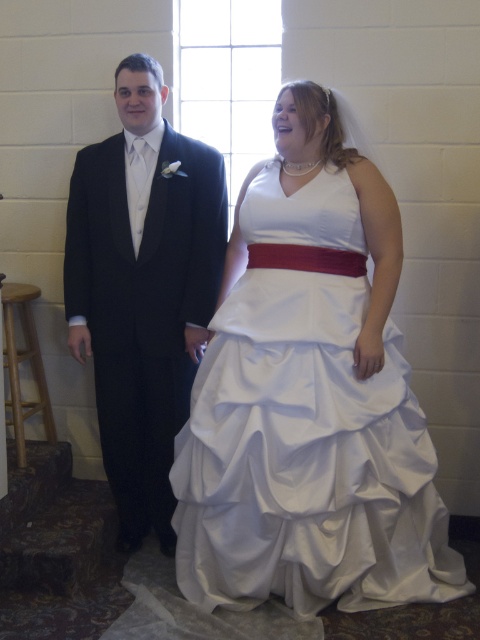
You are a photographer at a wedding. You need to position the couple so that the white satin dress at center and the black satin suit at left are visible in the frame. Based on their current positions, which direction should you move the couple to ensure both are centered in the photo?

Since the white satin dress at center is to the right of the black satin suit at left, you should move the couple slightly to the left to center both in the photo.

You are a photographer at the wedding and want to focus your camera on the white satin dress at center. The camera can only focus on objects within a 0.1 unit radius around the point specified. Is the point at coordinates point(307, 460) within the focus range of the camera?

The point at coordinates point(307, 460) corresponds to the white satin dress at center, so yes, the camera can focus on the white satin dress at center as it is exactly at the specified point.

You are a photographer at a wedding and need to adjust the camera focus. The white satin dress at center and the black satin suit at left are both in the frame. Which one is shorter in height?

The white satin dress at center is not as tall as the black satin suit at left, so the white satin dress at center is shorter in height.